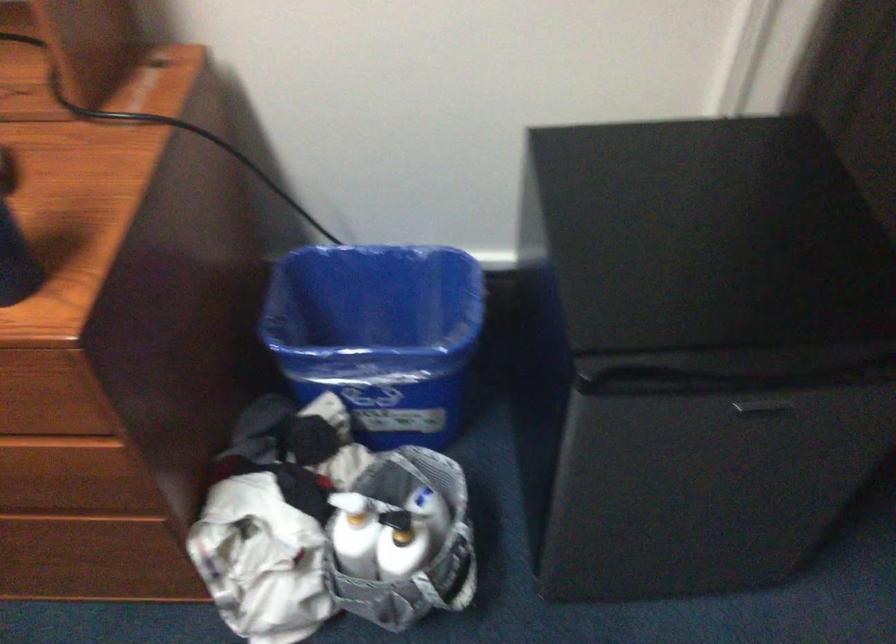
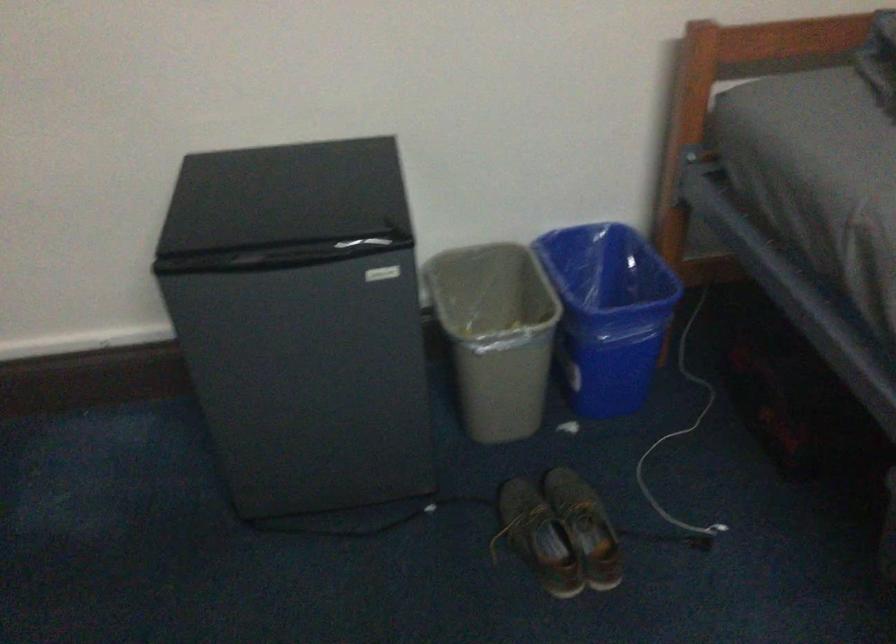
Based on the photo, the images are taken continuously from a first-person perspective. In which direction is your viewpoint rotating?

The camera's rotation is toward right-down.